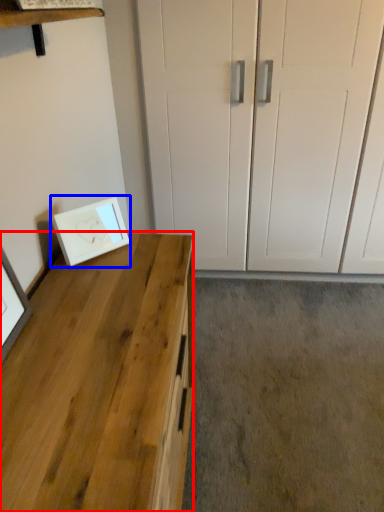
Question: Which point is closer to the camera, desk (highlighted by a red box) or picture frame (highlighted by a blue box)?

Choices:
 (A) desk
 (B) picture frame

Answer: (A)